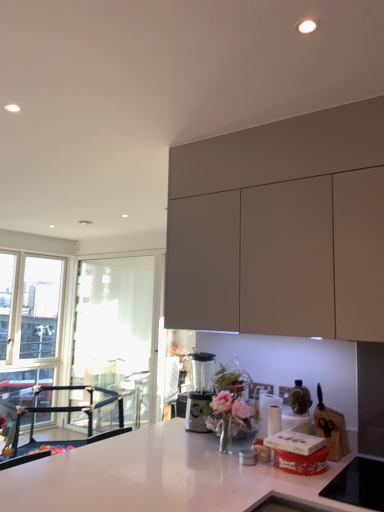
Find the location of a particular element. Image resolution: width=384 pixels, height=512 pixels. free space in front of sleek metallic blender at center is located at coordinates (183, 434).